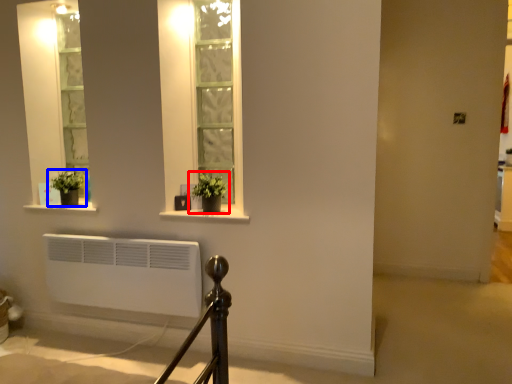
Question: Which of the following is the farthest to the observer, houseplant (highlighted by a red box) or houseplant (highlighted by a blue box)?

Choices:
 (A) houseplant
 (B) houseplant

Answer: (B)